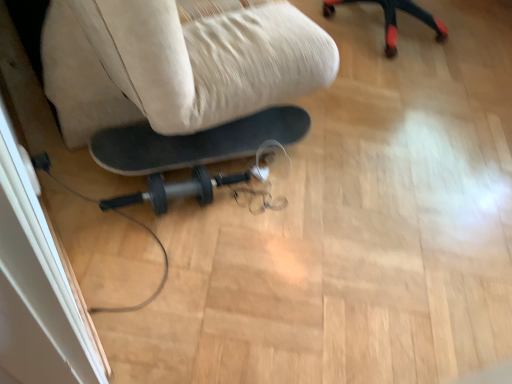
Question: Should I look upward or downward to see beige fabric swivel chair at center?

Choices:
 (A) down
 (B) up

Answer: (B)

Question: From the image's perspective, is beige fabric swivel chair at center beneath transparent plastic screen door at lower left?

Choices:
 (A) no
 (B) yes

Answer: (A)

Question: Would you say beige fabric swivel chair at center contains transparent plastic screen door at lower left?

Choices:
 (A) no
 (B) yes

Answer: (A)

Question: From a real-world perspective, is beige fabric swivel chair at center physically above transparent plastic screen door at lower left?

Choices:
 (A) yes
 (B) no

Answer: (A)

Question: Does beige fabric swivel chair at center have a lesser height compared to transparent plastic screen door at lower left?

Choices:
 (A) no
 (B) yes

Answer: (A)

Question: Can you confirm if beige fabric swivel chair at center is smaller than transparent plastic screen door at lower left?

Choices:
 (A) yes
 (B) no

Answer: (B)

Question: Is the depth of beige fabric swivel chair at center less than that of transparent plastic screen door at lower left?

Choices:
 (A) no
 (B) yes

Answer: (B)

Question: Is transparent plastic screen door at lower left thinner than beige fabric swivel chair at center?

Choices:
 (A) yes
 (B) no

Answer: (A)

Question: Is the position of transparent plastic screen door at lower left more distant than that of beige fabric swivel chair at center?

Choices:
 (A) yes
 (B) no

Answer: (A)

Question: Is transparent plastic screen door at lower left outside beige fabric swivel chair at center?

Choices:
 (A) no
 (B) yes

Answer: (B)

Question: From a real-world perspective, does transparent plastic screen door at lower left sit lower than beige fabric swivel chair at center?

Choices:
 (A) yes
 (B) no

Answer: (A)

Question: Can you confirm if transparent plastic screen door at lower left is smaller than beige fabric swivel chair at center?

Choices:
 (A) yes
 (B) no

Answer: (A)

Question: Can you confirm if transparent plastic screen door at lower left is taller than beige fabric swivel chair at center?

Choices:
 (A) no
 (B) yes

Answer: (A)

Question: Is transparent plastic screen door at lower left situated inside beige fabric swivel chair at center or outside?

Choices:
 (A) outside
 (B) inside

Answer: (A)